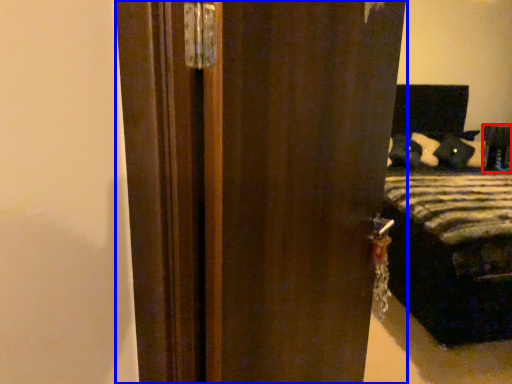
Question: Which of the following is the farthest to the observer, furniture (highlighted by a red box) or door (highlighted by a blue box)?

Choices:
 (A) furniture
 (B) door

Answer: (A)